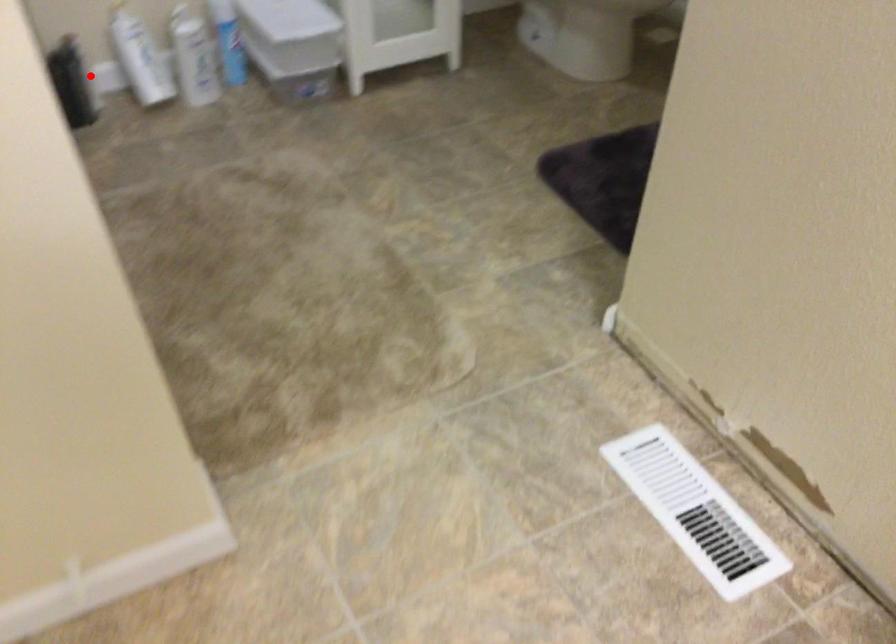
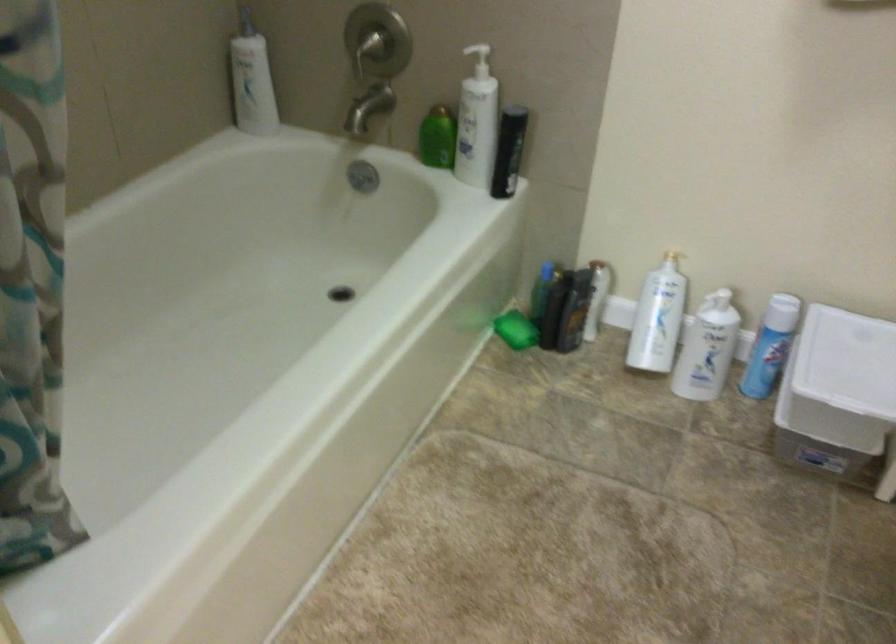
Locate, in the second image, the point that corresponds to the highlighted location in the first image.

(574, 310)